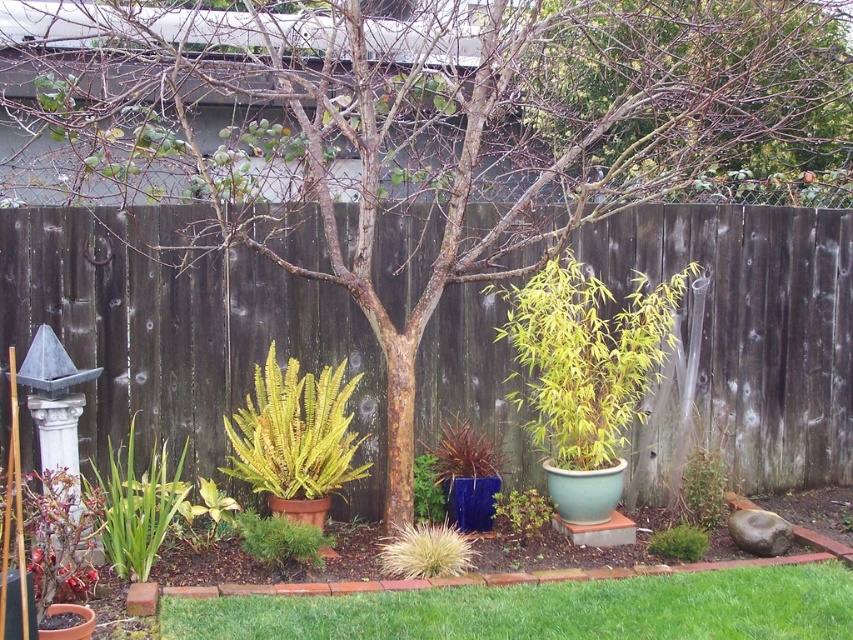
Between matte brown pot at lower left and green matte plant at center, which one appears on the right side from the viewer's perspective?

Positioned to the right is green matte plant at center.

Can you confirm if matte brown pot at lower left is bigger than green matte plant at center?

Incorrect, matte brown pot at lower left is not larger than green matte plant at center.

Does point (48, 609) come farther from viewer compared to point (312, 506)?

No, (48, 609) is closer to viewer.

Where is `matte brown pot at lower left`? Image resolution: width=853 pixels, height=640 pixels. matte brown pot at lower left is located at coordinates (67, 621).

Who is shorter, blue ceramic vase at center or matte brown pot at lower left?

With less height is matte brown pot at lower left.

Who is more forward, (488, 518) or (57, 628)?

Point (57, 628) is more forward.

At what (x,y) coordinates should I click in order to perform the action: click on blue ceramic vase at center. Please return your answer as a coordinate pair (x, y). Image resolution: width=853 pixels, height=640 pixels. Looking at the image, I should click on (471, 502).

Measure the distance between matte blue pot at center-right and matte brown pot at lower left.

matte blue pot at center-right and matte brown pot at lower left are 8.61 feet apart.

Who is positioned more to the left, matte blue pot at center-right or matte brown pot at lower left?

From the viewer's perspective, matte brown pot at lower left appears more on the left side.

Does point (613, 484) come behind point (48, 628)?

Yes, point (613, 484) is farther from viewer.

At what (x,y) coordinates should I click in order to perform the action: click on matte blue pot at center-right. Please return your answer as a coordinate pair (x, y). Looking at the image, I should click on (584, 492).